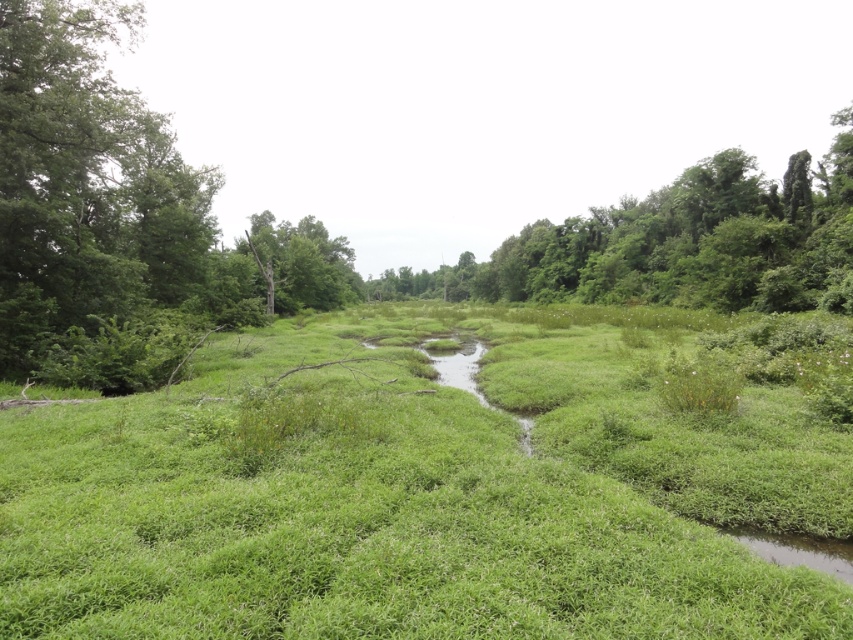
Question: Does green leafy tree at upper right have a larger size compared to brown rough tree trunk at center?

Choices:
 (A) no
 (B) yes

Answer: (B)

Question: Is green leafy tree at upper right thinner than brown rough tree trunk at center?

Choices:
 (A) yes
 (B) no

Answer: (B)

Question: Which object is the closest to the green grassy at center?

Choices:
 (A) brown rough tree trunk at center
 (B) green leafy tree at upper right

Answer: (A)

Question: Which of the following is the farthest from the observer?

Choices:
 (A) (119, 563)
 (B) (715, 232)

Answer: (B)

Question: Which object is the closest to the brown rough tree trunk at center?

Choices:
 (A) green grassy at center
 (B) green leafy tree at upper right

Answer: (B)

Question: Does green grassy at center have a greater width compared to green leafy tree at upper right?

Choices:
 (A) no
 (B) yes

Answer: (A)